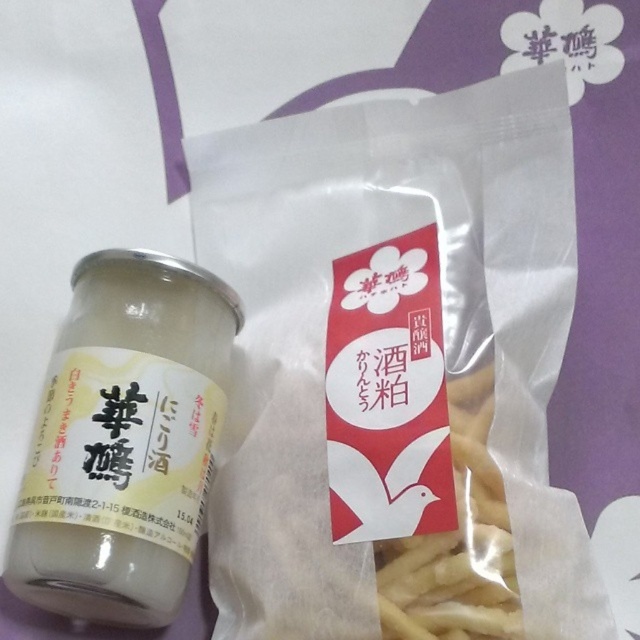
Question: Which point is closer to the camera taking this photo?

Choices:
 (A) (147, 476)
 (B) (486, 627)

Answer: (B)

Question: Which point is closer to the camera?

Choices:
 (A) translucent glass jar at center
 (B) yellow matte french fries at center

Answer: (B)

Question: Is translucent glass jar at center in front of yellow matte french fries at center?

Choices:
 (A) no
 (B) yes

Answer: (A)

Question: Which point is farther to the camera?

Choices:
 (A) yellow matte french fries at center
 (B) translucent glass jar at center

Answer: (B)

Question: Can you confirm if translucent glass jar at center is positioned below yellow matte french fries at center?

Choices:
 (A) no
 (B) yes

Answer: (A)

Question: Observing the image, what is the correct spatial positioning of translucent glass jar at center in reference to yellow matte french fries at center?

Choices:
 (A) left
 (B) right

Answer: (A)